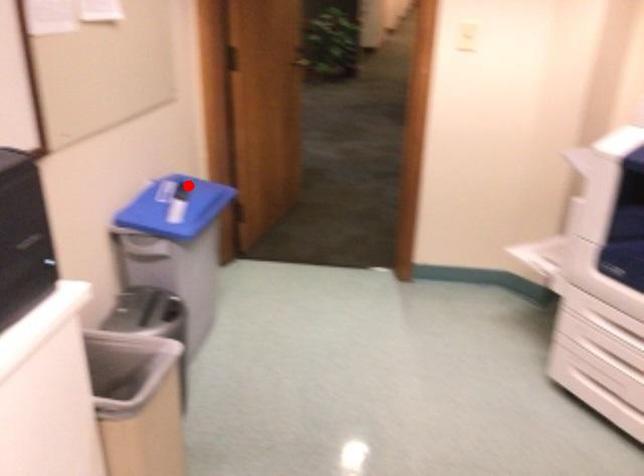
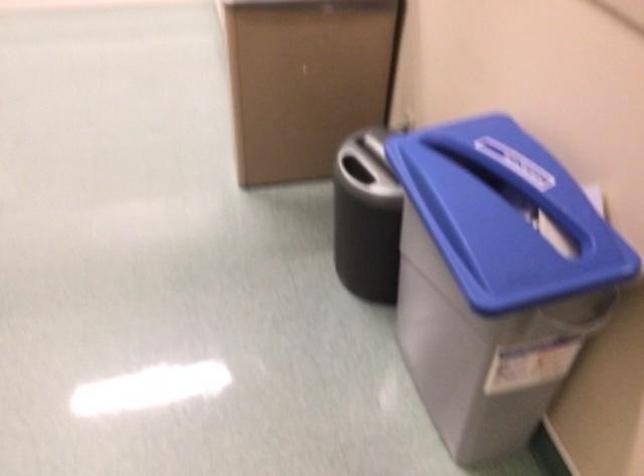
Locate, in the second image, the point that corresponds to the highlighted location in the first image.

(504, 214)